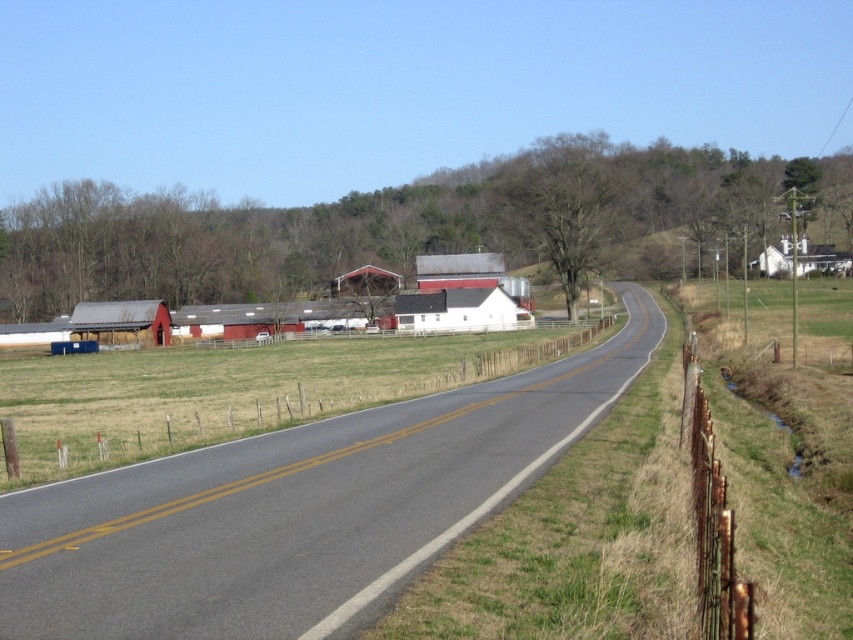
You are standing at the point closest to the viewer in the image. Which of the two points, point (x=88, y=301) or point (x=814, y=269), are you standing at?

You are standing at point (x=88, y=301) because it is closer to the viewer than point (x=814, y=269).

Looking at this image, you are a drone operator trying to capture aerial shots of the rural scene. You notice two points marked in the image. Which point, point 1 at coordinates (73, 333) or point 2 at coordinates (370, 280), is closer to your drone camera lens?

Point 1 at coordinates (73, 333) is closer to the camera than point 2 at coordinates (370, 280).